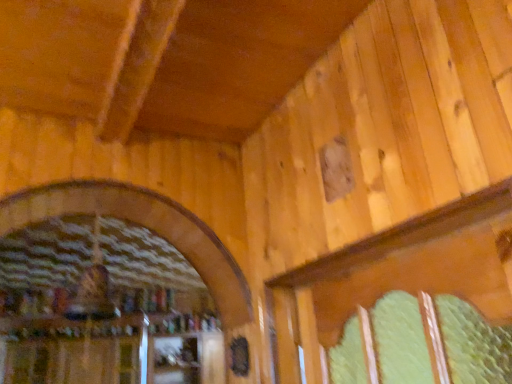
I want to click on wooden shelf at lower left, so click(x=99, y=350).

Measure the distance between wooden shelf at lower left and camera.

wooden shelf at lower left and camera are 3.48 meters apart from each other.

What do you see at coordinates (99, 350) in the screenshot? This screenshot has height=384, width=512. I see `wooden shelf at lower left` at bounding box center [99, 350].

Locate an element on the screen. Image resolution: width=512 pixels, height=384 pixels. wooden shelf at lower left is located at coordinates (99, 350).